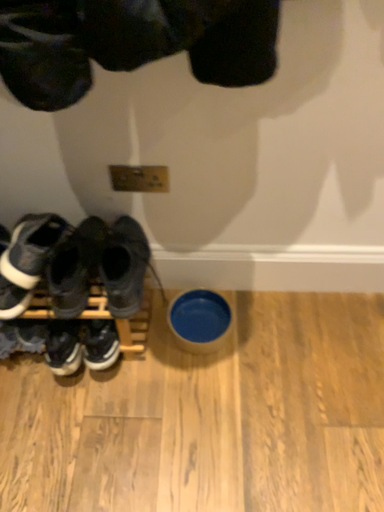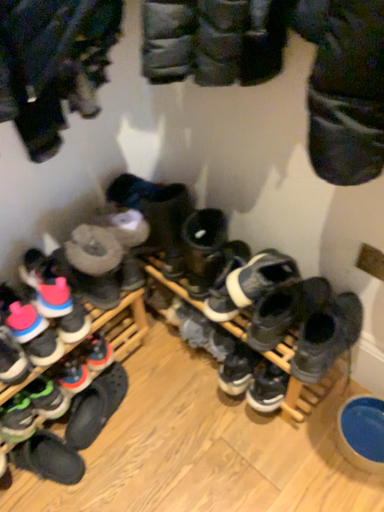
Question: How did the camera likely rotate when shooting the video?

Choices:
 (A) rotated left
 (B) rotated right

Answer: (A)